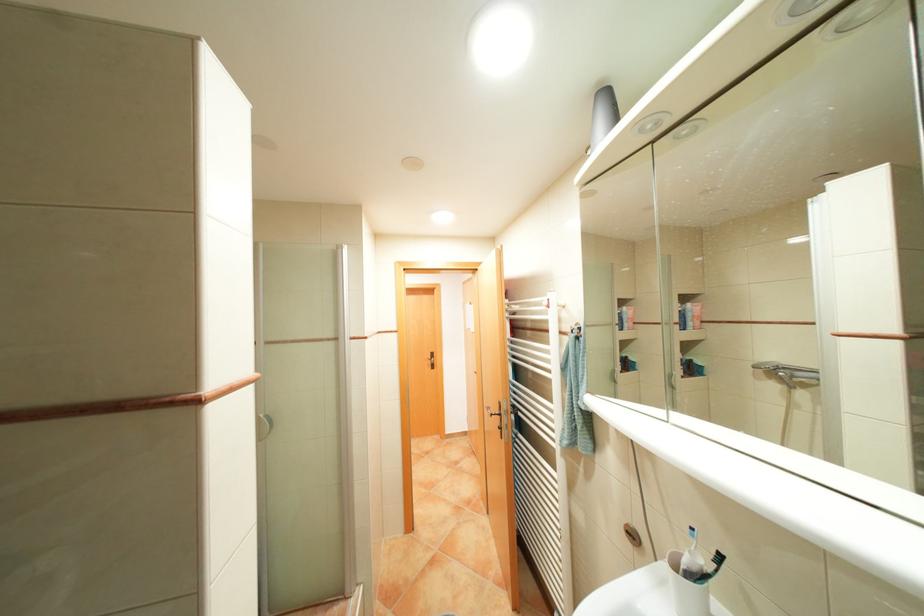
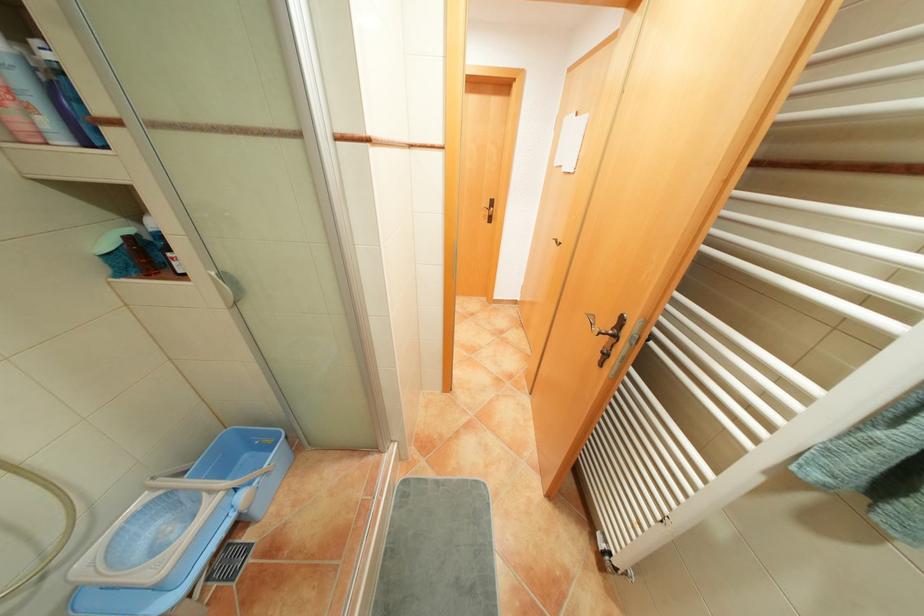
Locate, in the second image, the point that corresponds to [576,442] in the first image.

(828, 475)